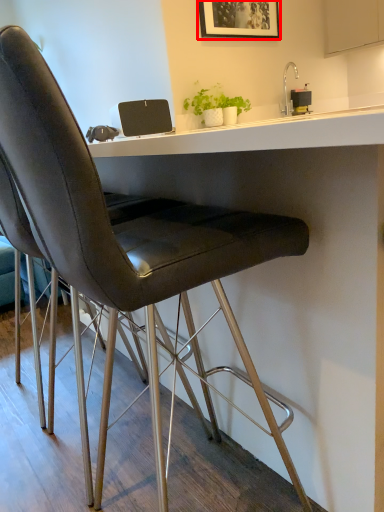
Question: In this image, where is picture frame (annotated by the red box) located relative to cabinetry?

Choices:
 (A) right
 (B) left

Answer: (B)